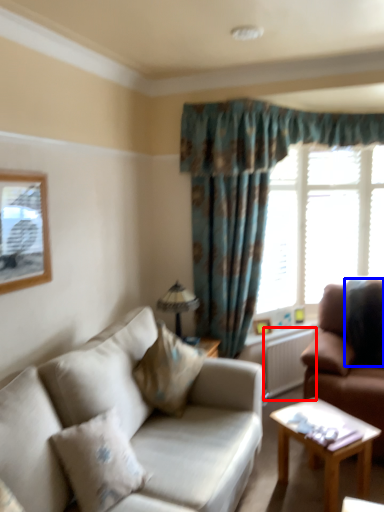
Question: Among these objects, which one is farthest to the camera, radiator (highlighted by a red box) or pillow (highlighted by a blue box)?

Choices:
 (A) radiator
 (B) pillow

Answer: (A)